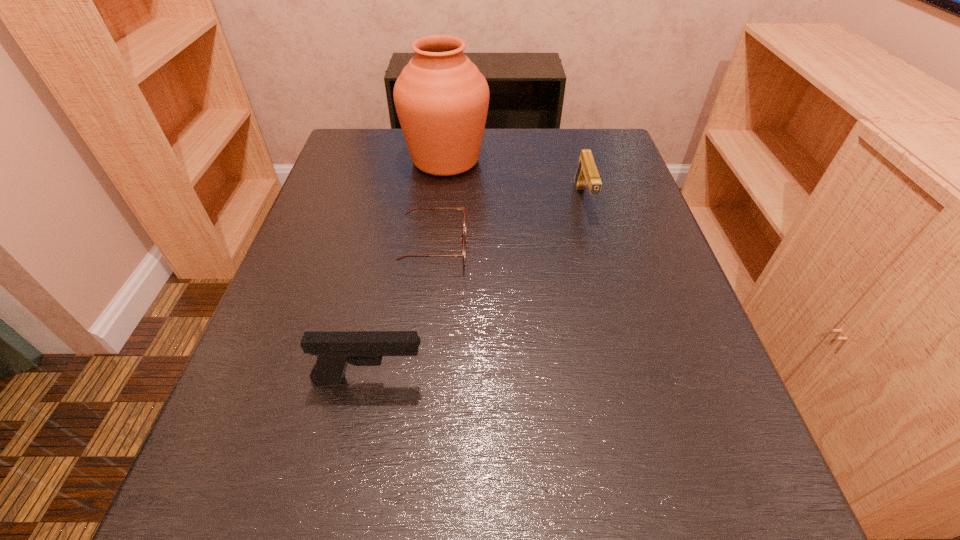
Locate an element on the screen. The height and width of the screenshot is (540, 960). urn is located at coordinates (441, 98).

At what (x,y) coordinates should I click in order to perform the action: click on the nearer pistol. Please return your answer as a coordinate pair (x, y). Image resolution: width=960 pixels, height=540 pixels. Looking at the image, I should click on (334, 350).

The height and width of the screenshot is (540, 960). I want to click on the nearest object, so click(x=334, y=350).

Find the location of a particular element. Image resolution: width=960 pixels, height=540 pixels. the right pistol is located at coordinates (587, 173).

Where is `the rightmost object`? the rightmost object is located at coordinates (587, 173).

Locate an element on the screen. Image resolution: width=960 pixels, height=540 pixels. spectacles is located at coordinates (464, 230).

Where is `the third farthest object`? the third farthest object is located at coordinates (464, 230).

This screenshot has height=540, width=960. Find the location of `blank space located on the left of the tallest object`. blank space located on the left of the tallest object is located at coordinates (339, 160).

The width and height of the screenshot is (960, 540). In order to click on free space located on the front-facing side of the nearest object in this screenshot , I will do `click(670, 380)`.

Identify the location of free spot located at the barrel of the rightmost object. (626, 359).